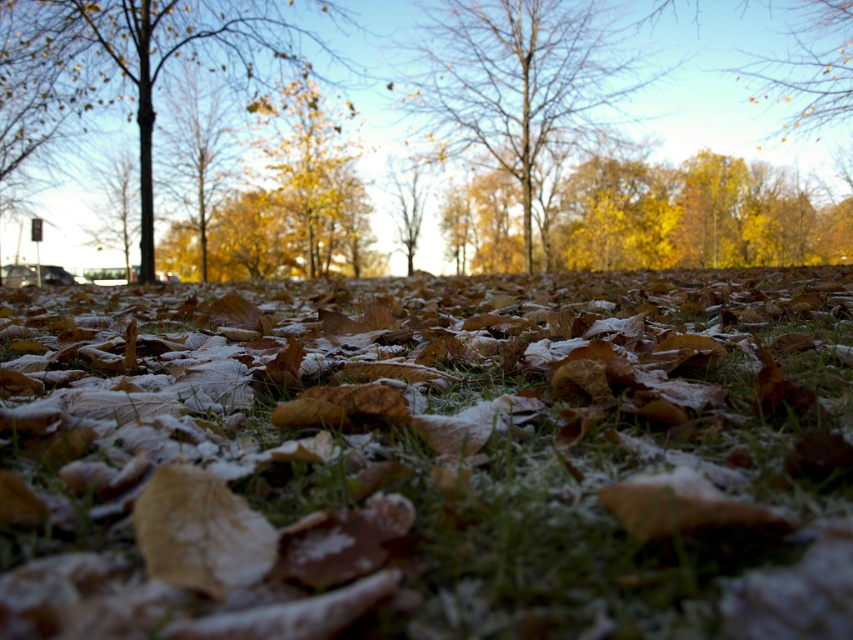
You are a bird flying over the autumn scene. You see the brown wood tree at left and the yellow matte leaves at upper center. Which object is higher in the sky?

The brown wood tree at left is much taller than the yellow matte leaves at upper center, so it is higher in the sky.

You are standing in the autumnal scene and want to step on the frosted green grass at center. Based on its position, is it closer to the front or the back of the image?

The frosted green grass at center is located at point 0.716 on the x and 0.506 on the y, which places it closer to the back of the image since it is positioned towards the upper part of the scene.

You are an artist sketching the autumn scene. You need to draw the bare branches at center and the yellow matte leaves at upper center. According to the scene, which object should you draw first to maintain the correct spatial arrangement?

You should draw the bare branches at center first because they are positioned to the left of the yellow matte leaves at upper center, so they appear closer in the spatial arrangement.